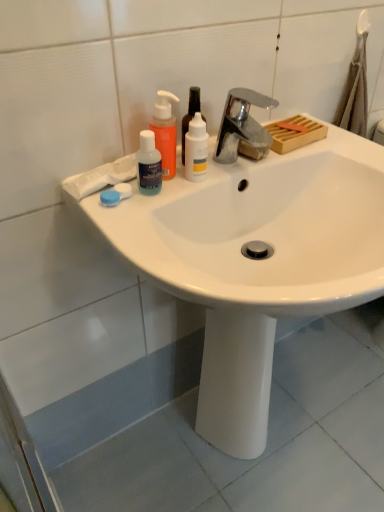
This screenshot has height=512, width=384. I want to click on vacant region in front of white glossy bottle at center, marked as the 2th mouthwash in a left-to-right arrangement, so click(x=162, y=203).